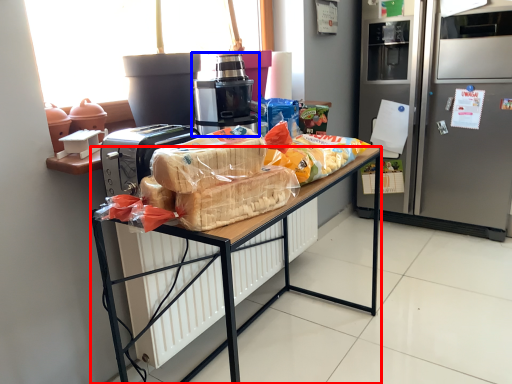
Question: Which of the following is the farthest to the observer, desk (highlighted by a red box) or home appliance (highlighted by a blue box)?

Choices:
 (A) desk
 (B) home appliance

Answer: (B)